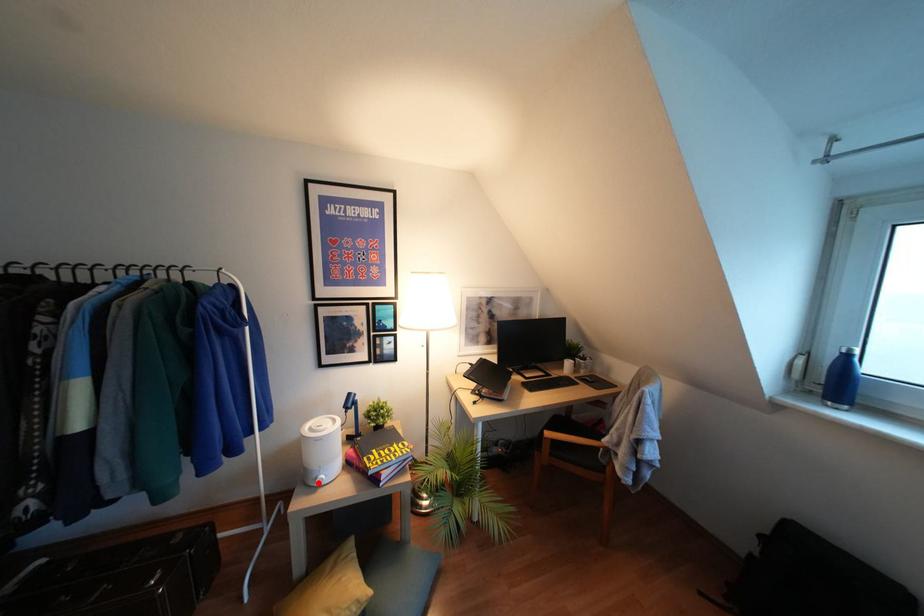
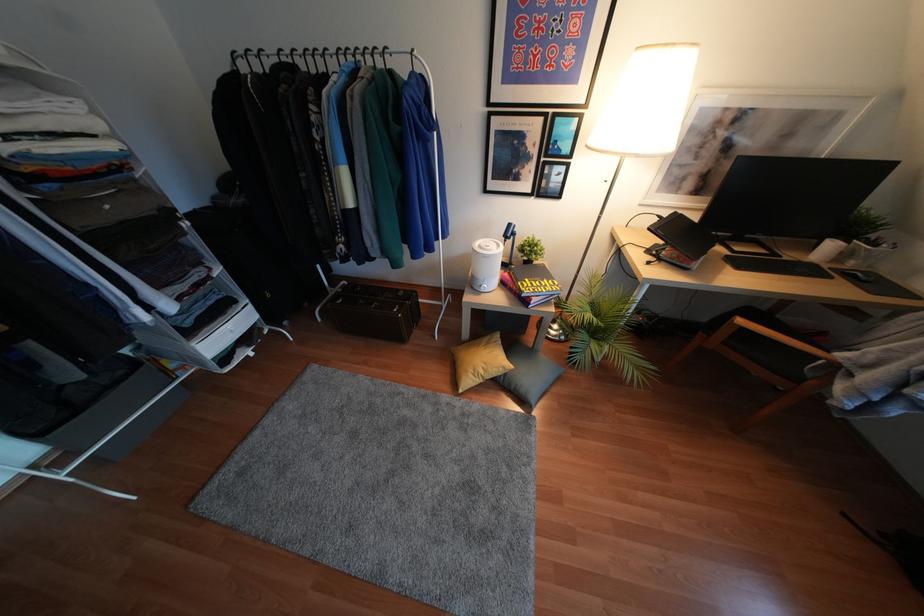
Question: I am providing you with two images of the same scene from different viewpoints. A red point is shown in image1. For the corresponding object point in image2, is it positioned nearer or farther from the camera?

Choices:
 (A) Nearer
 (B) Farther

Answer: (A)